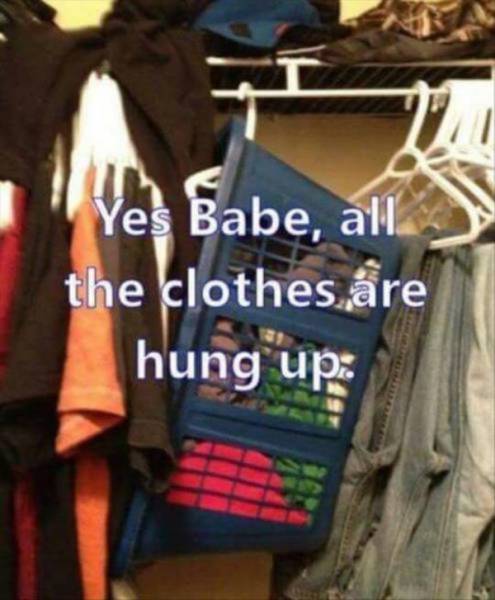
This screenshot has width=495, height=600. Identify the location of laundry basket. (269, 312).